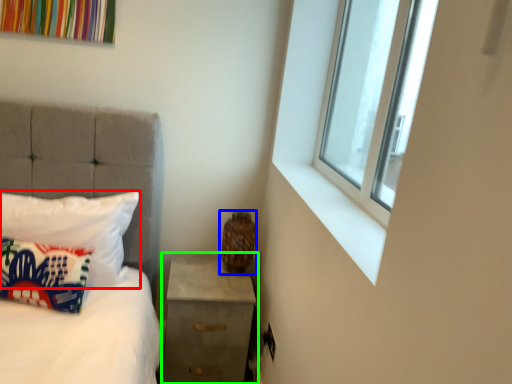
Question: Which object is the closest to the pillow (highlighted by a red box)? Choose among these: vase (highlighted by a blue box) or nightstand (highlighted by a green box).

Choices:
 (A) vase
 (B) nightstand

Answer: (B)